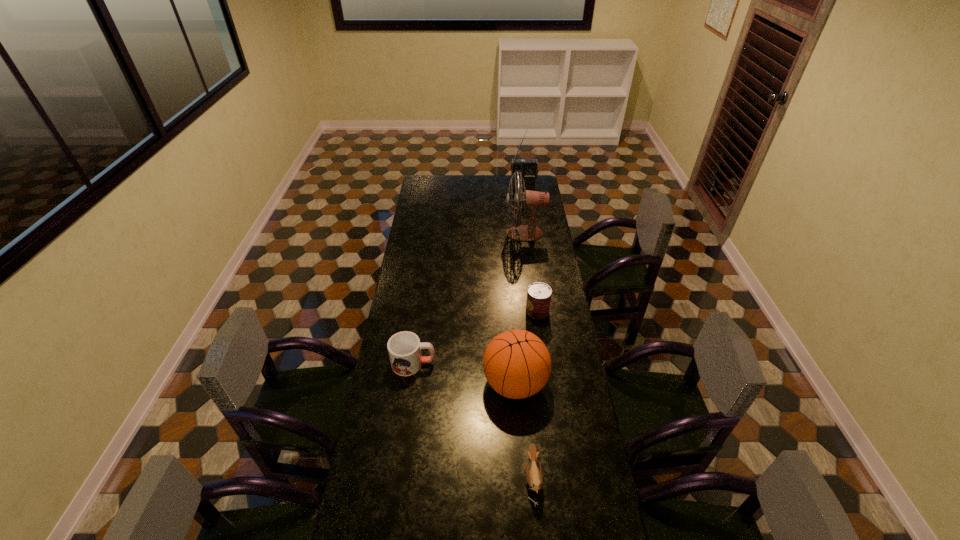
Locate an element on the screen. The image size is (960, 540). vacant position located in front of the fifth nearest object to direct airflow is located at coordinates (441, 233).

Locate an element on the screen. vacant space situated on the left of the basketball is located at coordinates (412, 383).

The image size is (960, 540). In order to click on free space located on the front of the third farthest object in this screenshot , I will do `click(549, 397)`.

The image size is (960, 540). I want to click on vacant space located 0.110m on the side of the mug with the handle, so click(463, 363).

I want to click on vacant space situated 0.220m at the beak of the nearest object, so click(456, 479).

You are a GUI agent. You are given a task and a screenshot of the screen. Output one action in this format:
    pyautogui.click(x=<x>, y=<y>)
    Task: Click on the vacant space located 0.220m at the beak of the nearest object
    
    Given the screenshot: What is the action you would take?
    pyautogui.click(x=456, y=479)

Where is `vacant space located 0.170m at the beak of the nearest object`? The image size is (960, 540). vacant space located 0.170m at the beak of the nearest object is located at coordinates (472, 479).

The image size is (960, 540). I want to click on object that is at the far edge, so click(x=528, y=168).

I want to click on object that is at the left edge, so click(x=404, y=348).

The image size is (960, 540). Find the location of `radio receiver at the right edge`. radio receiver at the right edge is located at coordinates (528, 168).